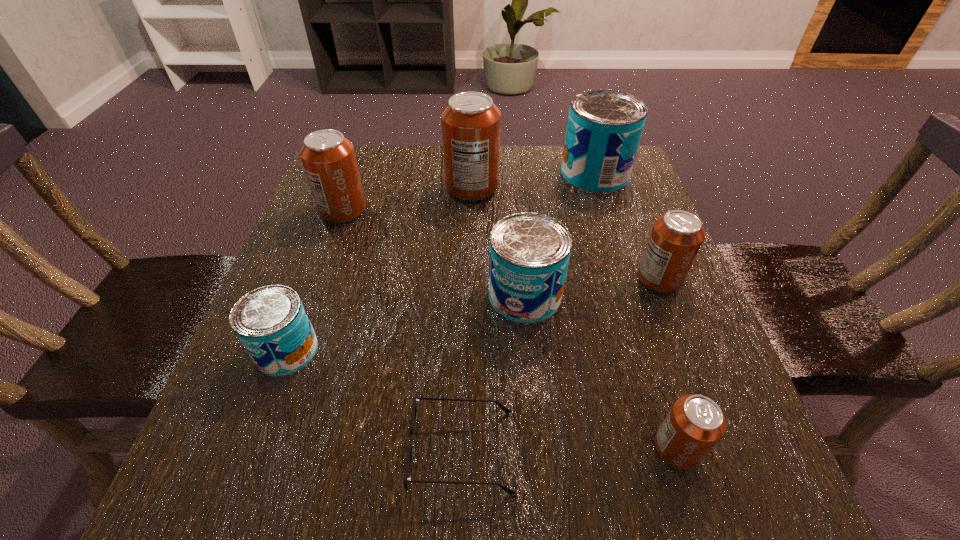
Identify the location of object that is the fifth nearest to the second smallest blue can. Image resolution: width=960 pixels, height=540 pixels. (604, 128).

At what (x,y) coordinates should I click in order to perform the action: click on object that is the seventh closest to the third farthest orange can. Please return your answer as a coordinate pair (x, y). This screenshot has height=540, width=960. Looking at the image, I should click on [271, 322].

Where is `can that is the second closest to the leftmost orange can`? This screenshot has width=960, height=540. can that is the second closest to the leftmost orange can is located at coordinates (271, 322).

You are a GUI agent. You are given a task and a screenshot of the screen. Output one action in this format:
    pyautogui.click(x=<x>, y=<y>)
    Task: Click on the can that stands as the fourth closest to the third nearest object
    The image size is (960, 540).
    Given the screenshot: What is the action you would take?
    pyautogui.click(x=694, y=425)

The image size is (960, 540). I want to click on orange can that is the nearest to the third nearest object, so click(328, 158).

Find the location of `orange can identified as the third closest to the second smallest orange can`. orange can identified as the third closest to the second smallest orange can is located at coordinates (328, 158).

Identify which blue can is the second nearest to the shortest object. Please provide its 2D coordinates. Your answer should be formatted as a tuple, i.e. [(x, y)], where the tuple contains the x and y coordinates of a point satisfying the conditions above.

[(271, 322)]

Select which blue can appears as the second closest to the second biggest blue can. Please provide its 2D coordinates. Your answer should be formatted as a tuple, i.e. [(x, y)], where the tuple contains the x and y coordinates of a point satisfying the conditions above.

[(271, 322)]

What are the coordinates of `free space that satisfies the following two spatial constraints: 1. on the back side of the third smallest orange can; 2. on the right side of the biggest blue can` in the screenshot? It's located at (356, 174).

Locate an element on the screen. The width and height of the screenshot is (960, 540). vacant position in the image that satisfies the following two spatial constraints: 1. on the front side of the biggest orange can; 2. on the right side of the second blue can from right to left is located at coordinates (469, 296).